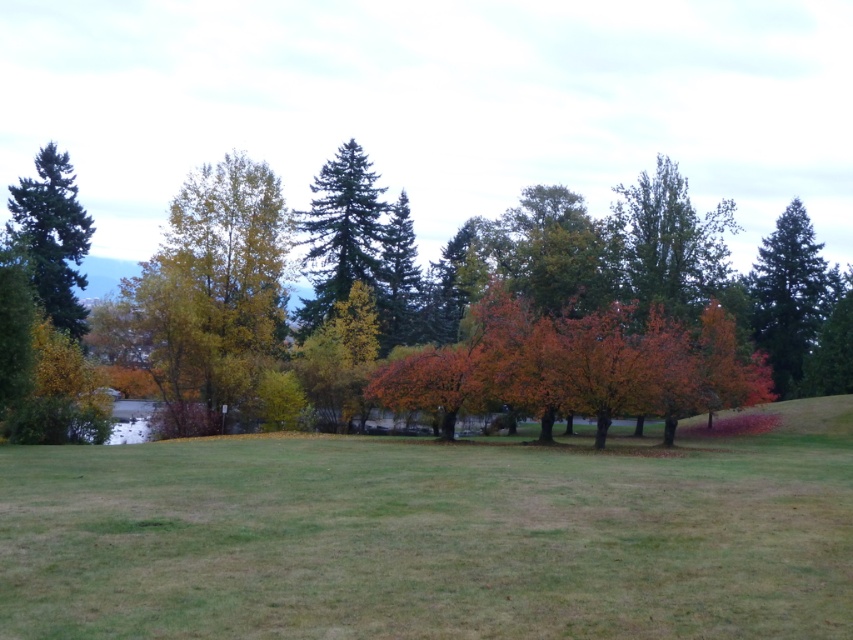
Does autumn leaves tree at center have a lesser height compared to green matte tree at right?

No.

Consider the image. Can you confirm if autumn leaves tree at center is wider than green matte tree at right?

Yes, autumn leaves tree at center is wider than green matte tree at right.

Does point (309, 243) come in front of point (827, 292)?

Yes.

Locate an element on the screen. autumn leaves tree at center is located at coordinates (509, 262).

From the picture: Between green coniferous tree at center and green matte tree at right, which one is positioned lower?

green matte tree at right is below.

Is green coniferous tree at center below green matte tree at right?

No, green coniferous tree at center is not below green matte tree at right.

Is point (352, 172) behind point (810, 264)?

No, it is in front of (810, 264).

In order to click on green coniferous tree at center in this screenshot , I will do `click(340, 234)`.

Does autumn leaves tree at center have a larger size compared to green matte evergreen tree at left?

Indeed, autumn leaves tree at center has a larger size compared to green matte evergreen tree at left.

Is autumn leaves tree at center below green matte evergreen tree at left?

Yes.

Find the location of a particular element. This screenshot has height=640, width=853. autumn leaves tree at center is located at coordinates (509, 262).

Image resolution: width=853 pixels, height=640 pixels. What are the coordinates of `autumn leaves tree at center` in the screenshot? It's located at (509, 262).